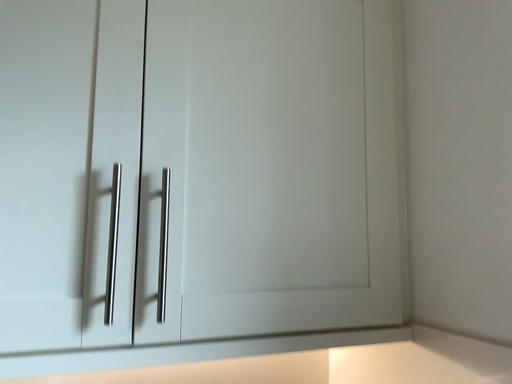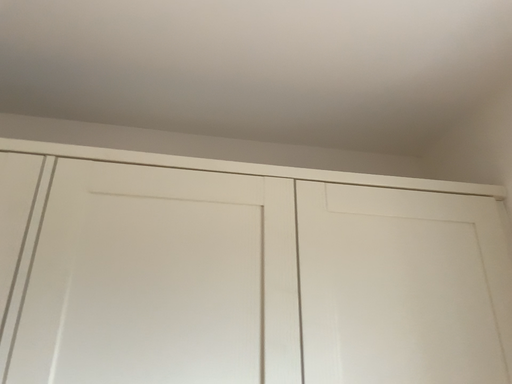
Question: How did the camera likely rotate when shooting the video?

Choices:
 (A) rotated upward
 (B) rotated downward

Answer: (A)